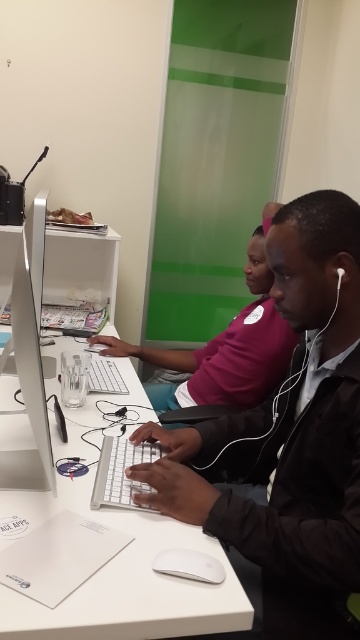
Between black matte jacket at center and sleek silver monitor at left, which one appears on the left side from the viewer's perspective?

sleek silver monitor at left is more to the left.

Does black matte jacket at center appear on the right side of sleek silver monitor at left?

Yes, black matte jacket at center is to the right of sleek silver monitor at left.

The image size is (360, 640). What are the coordinates of `black matte jacket at center` in the screenshot? It's located at (288, 436).

Locate an element on the screen. black matte jacket at center is located at coordinates (288, 436).

The height and width of the screenshot is (640, 360). I want to click on matte black shirt at center, so click(x=225, y=349).

Is matte black shirt at center shorter than white matte mouse at center?

No.

Describe the element at coordinates (225, 349) in the screenshot. Image resolution: width=360 pixels, height=640 pixels. I see `matte black shirt at center` at that location.

Where is `matte black shirt at center`? This screenshot has height=640, width=360. matte black shirt at center is located at coordinates coord(225,349).

This screenshot has height=640, width=360. I want to click on sleek silver monitor at left, so click(29, 358).

Is sleek silver monitor at left to the right of white matte mouse at center from the viewer's perspective?

No, sleek silver monitor at left is not to the right of white matte mouse at center.

Is point (32, 349) closer to camera compared to point (180, 570)?

No.

At what (x,y) coordinates should I click in order to perform the action: click on sleek silver monitor at left. Please return your answer as a coordinate pair (x, y). The height and width of the screenshot is (640, 360). Looking at the image, I should click on (29, 358).